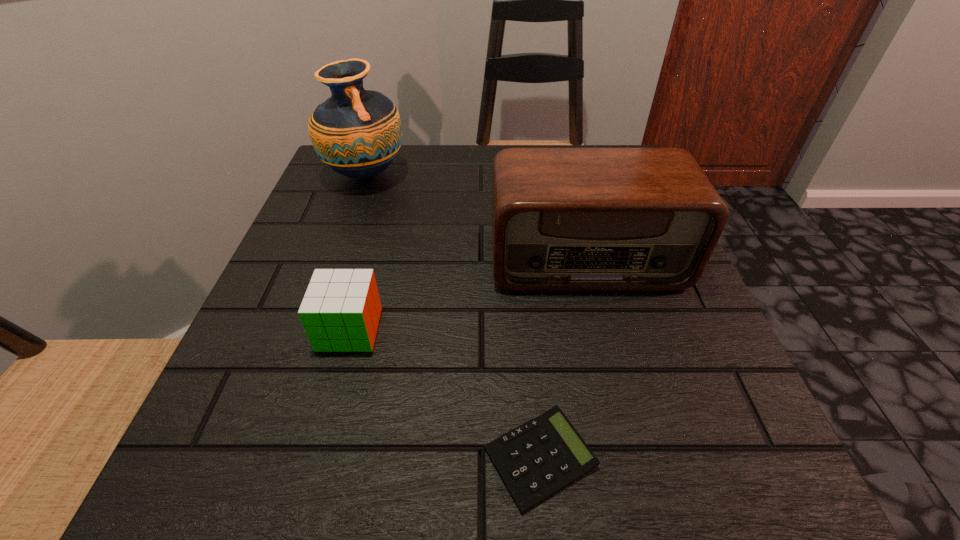
Where is `vacant area located 0.310m on the right of the second shortest object`? The height and width of the screenshot is (540, 960). vacant area located 0.310m on the right of the second shortest object is located at coordinates (580, 329).

Where is `free space located on the right of the nearest object`? The width and height of the screenshot is (960, 540). free space located on the right of the nearest object is located at coordinates (729, 458).

Locate an element on the screen. This screenshot has height=540, width=960. object present at the far edge is located at coordinates (357, 133).

Locate an element on the screen. Image resolution: width=960 pixels, height=540 pixels. object that is at the near edge is located at coordinates (537, 459).

The height and width of the screenshot is (540, 960). I want to click on pottery that is at the left edge, so click(357, 133).

Find the location of a particular element. Image resolution: width=960 pixels, height=540 pixels. cube that is at the left edge is located at coordinates (340, 311).

Find the location of `object that is at the right edge`. object that is at the right edge is located at coordinates (563, 219).

Image resolution: width=960 pixels, height=540 pixels. I want to click on object situated at the far left corner, so click(357, 133).

Identify the location of free space at the far edge of the desktop. (438, 154).

The height and width of the screenshot is (540, 960). Identify the location of vacant space at the near edge of the desktop. (395, 512).